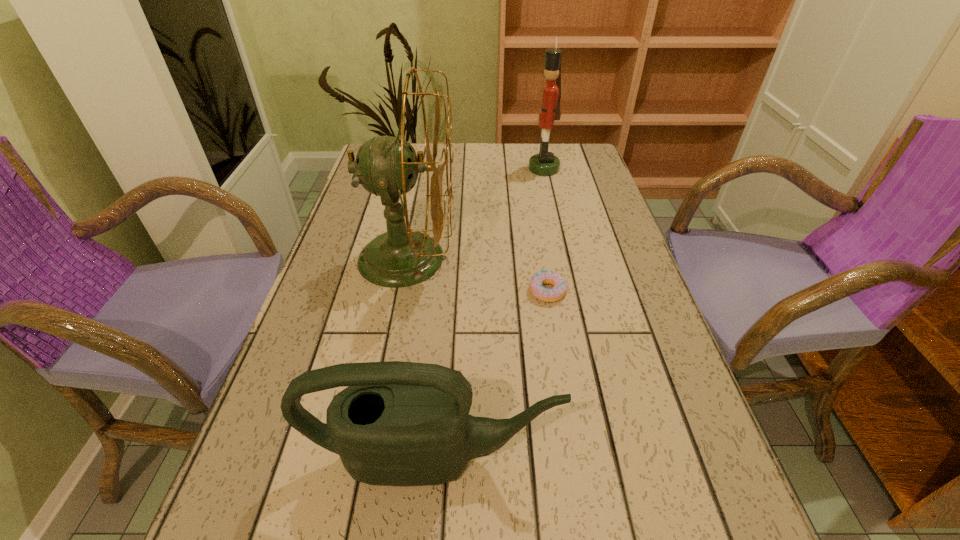
You are a GUI agent. You are given a task and a screenshot of the screen. Output one action in this format:
    pyautogui.click(x=<x>, y=<y>)
    Task: Click on the empty space between the fan and the doughnut
    The image size is (960, 540).
    Given the screenshot: What is the action you would take?
    pyautogui.click(x=477, y=275)

At what (x,y) coordinates should I click in order to perform the action: click on empty space between the shortest object and the second shortest object. Please return your answer as a coordinate pair (x, y). This screenshot has height=540, width=960. Looking at the image, I should click on (491, 375).

Where is `vacant area that lies between the farthest object and the shortest object`? vacant area that lies between the farthest object and the shortest object is located at coordinates (546, 230).

At what (x,y) coordinates should I click in order to perform the action: click on vacant space that's between the fan and the farthest object. Please return your answer as a coordinate pair (x, y). The height and width of the screenshot is (540, 960). Looking at the image, I should click on tap(475, 213).

This screenshot has height=540, width=960. Identify the location of empty space between the nearest object and the doughnut. (491, 375).

Find the location of a particular element. The width and height of the screenshot is (960, 540). unoccupied area between the farthest object and the doughnut is located at coordinates (546, 230).

At what (x,y) coordinates should I click in order to perform the action: click on vacant space in between the farthest object and the nearest object. Please return your answer as a coordinate pair (x, y). Looking at the image, I should click on (489, 313).

Identify the location of vacant space that's between the watering can and the fan. (420, 358).

Select which object appears as the second closest to the second shortest object. Please provide its 2D coordinates. Your answer should be formatted as a tuple, i.e. [(x, y)], where the tuple contains the x and y coordinates of a point satisfying the conditions above.

[(541, 293)]

You are a GUI agent. You are given a task and a screenshot of the screen. Output one action in this format:
    pyautogui.click(x=<x>, y=<y>)
    Task: Click on the closest object to the nutcracker
    
    Given the screenshot: What is the action you would take?
    pyautogui.click(x=385, y=166)